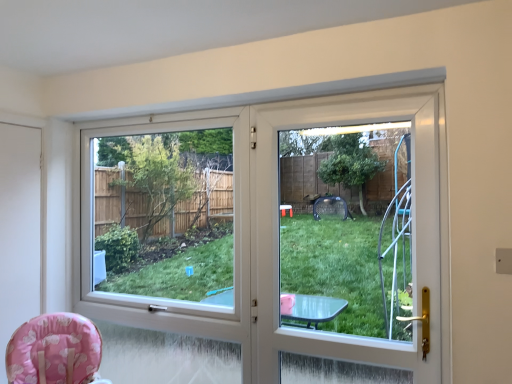
Question: Is white matte screen door at left, which is the 2th screen door from front to back, in front of or behind pink fabric baby chair at lower left in the image?

Choices:
 (A) behind
 (B) front

Answer: (A)

Question: From a real-world perspective, is white matte screen door at left, which is the 2th screen door from front to back, above or below pink fabric baby chair at lower left?

Choices:
 (A) below
 (B) above

Answer: (B)

Question: Estimate the real-world distances between objects in this image. Which object is closer to the white matte screen door at left, positioned as the second screen door in right-to-left order?

Choices:
 (A) transparent plastic window screen at center
 (B) pink fabric baby chair at lower left
 (C) white plastic screen door at center, placed as the first screen door when sorted from front to back

Answer: (B)

Question: Which is farther from the white plastic screen door at center, acting as the second screen door starting from the left?

Choices:
 (A) transparent plastic window screen at center
 (B) white matte screen door at left, which is the 2th screen door from front to back
 (C) pink fabric baby chair at lower left

Answer: (A)